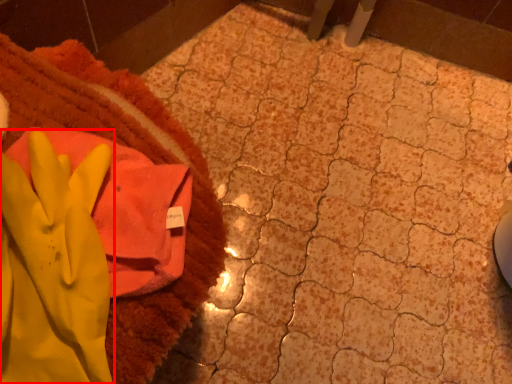
Question: From the image's perspective, where is glove (annotated by the red box) located relative to towel?

Choices:
 (A) below
 (B) above

Answer: (A)